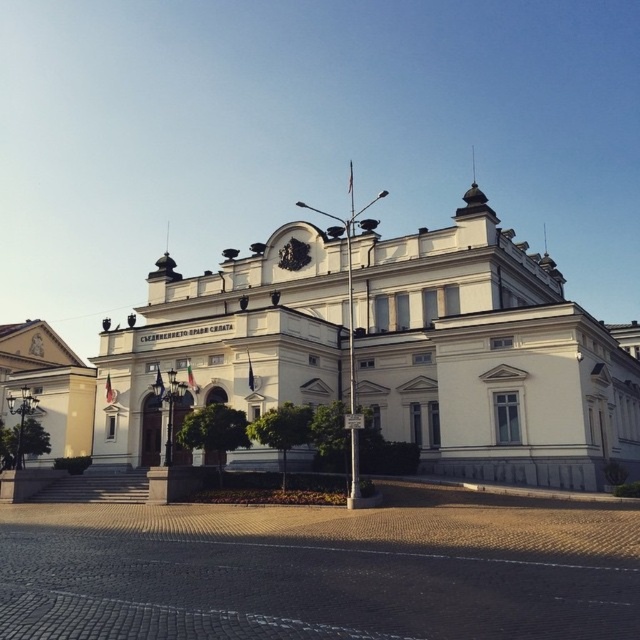
You are standing at the point with coordinates 0.3, 0.3 in the image. You want to walk to the white stone building at center. In which direction should you move?

The white stone building at center is located at point (388, 349). Since you are at (192, 192), you should move northeast to reach it.

You are standing in front of the grand neoclassical building and want to take a photo that includes both the white stone building at center and the white stone building at lower left. Which building should you position closer to the camera to ensure both are fully visible in the frame?

You should position the white stone building at center closer to the camera because it is in front of the white stone building at lower left, allowing both to be visible without obstruction.